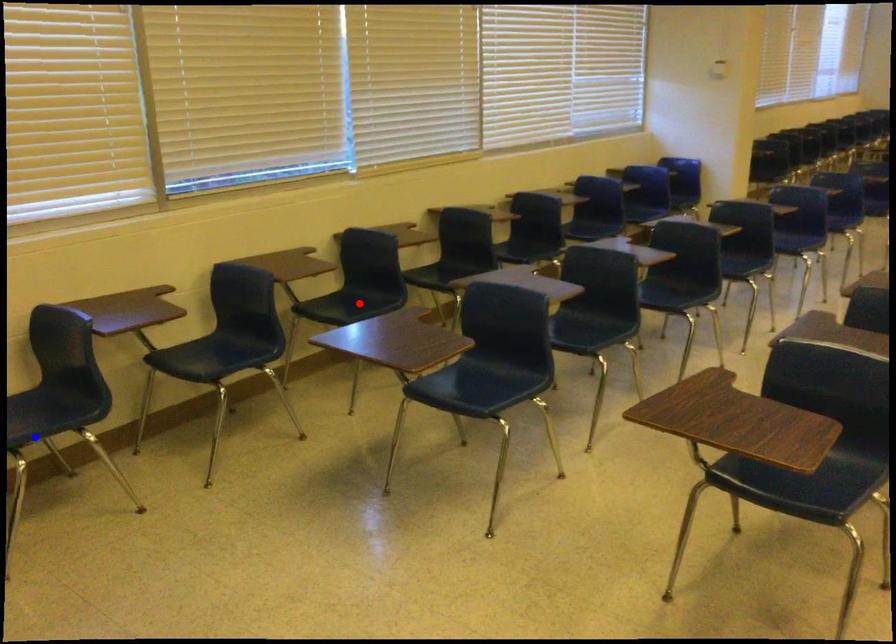
Question: In the image, two points are highlighted. Which point is nearer to the camera? Reply with the corresponding letter.

Choices:
 (A) blue point
 (B) red point

Answer: (A)